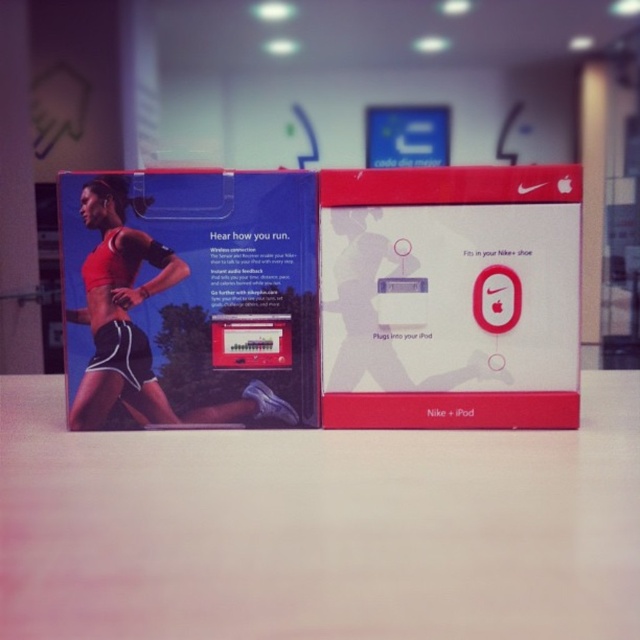
Question: Which object appears closest to the camera in this image?

Choices:
 (A) white matte table at center
 (B) matte black sports bra at center
 (C) matte red box at center

Answer: (A)

Question: Does matte red box at center appear on the left side of matte black sports bra at center?

Choices:
 (A) no
 (B) yes

Answer: (A)

Question: Which point is farther to the camera?

Choices:
 (A) white matte table at center
 (B) matte red box at center

Answer: (B)

Question: Can you confirm if matte red box at center is positioned below matte black sports bra at center?

Choices:
 (A) no
 (B) yes

Answer: (A)

Question: Can you confirm if white matte table at center is thinner than matte red box at center?

Choices:
 (A) no
 (B) yes

Answer: (A)

Question: Based on their relative distances, which object is farther from the matte red box at center?

Choices:
 (A) matte black sports bra at center
 (B) white matte table at center

Answer: (A)